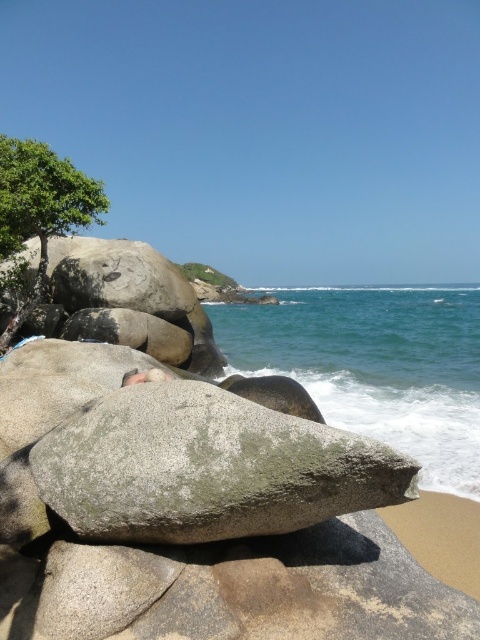
You are standing on the beach and want to take a photo of the gray granite rock at center and the green leafy tree at upper left. Which object should you adjust your camera to focus on first if you want both in the frame without moving the camera?

You should focus on the green leafy tree at upper left first because the gray granite rock at center is to the right of it, so adjusting the camera to include both would require framing from the left side where the tree is positioned.